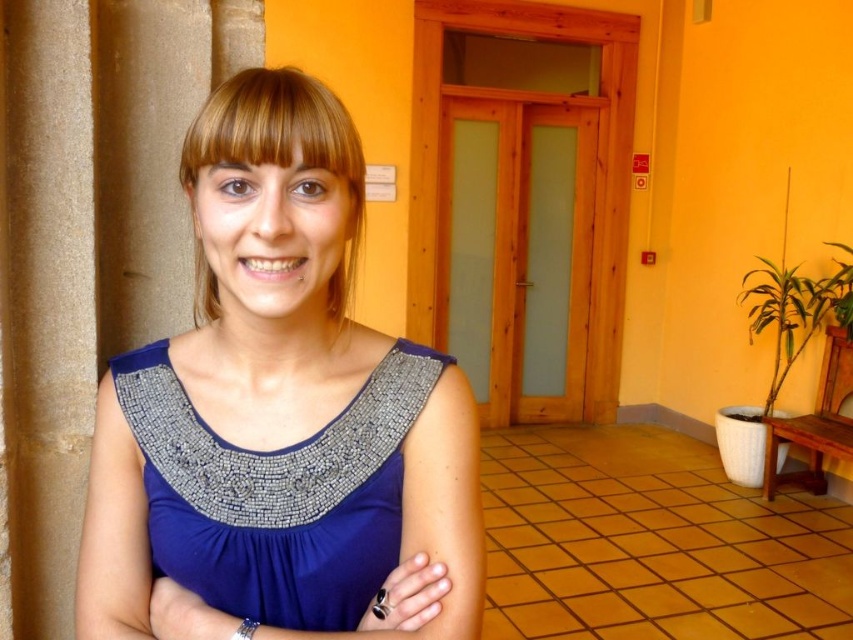
You are a fashion designer observing the scene. You need to decide which item has a greater width between the blue fabric dress at center and the silver metallic bracelet at lower center. Which one is wider?

The blue fabric dress at center is wider than the silver metallic bracelet at lower center according to the description.

You are standing in a hallway and see the blue fabric dress at center and the brown stone pillar at left. Which object is positioned to the right of the other?

The blue fabric dress at center is positioned to the right of the brown stone pillar at left.